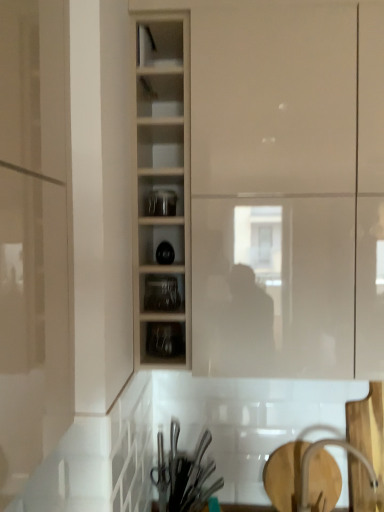
Question: Does clear glass jars at center, the first shelf in the top-to-bottom sequence, have a smaller size compared to matte white cupboard at center?

Choices:
 (A) yes
 (B) no

Answer: (A)

Question: Is the depth of clear glass jars at center, the first shelf in the top-to-bottom sequence, greater than that of matte white cupboard at center?

Choices:
 (A) no
 (B) yes

Answer: (B)

Question: Can you confirm if clear glass jars at center, the first shelf in the top-to-bottom sequence, is taller than matte white cupboard at center?

Choices:
 (A) yes
 (B) no

Answer: (B)

Question: Is clear glass jars at center, which ranks as the second shelf in bottom-to-top order, oriented away from matte white cupboard at center?

Choices:
 (A) no
 (B) yes

Answer: (A)

Question: Does clear glass jars at center, the first shelf in the top-to-bottom sequence, touch matte white cupboard at center?

Choices:
 (A) no
 (B) yes

Answer: (A)

Question: Based on their positions, is white glossy faucet at lower right located to the left or right of clear glass jars at center, the first shelf in the top-to-bottom sequence?

Choices:
 (A) right
 (B) left

Answer: (A)

Question: Is white glossy faucet at lower right spatially inside clear glass jars at center, which ranks as the second shelf in bottom-to-top order, or outside of it?

Choices:
 (A) outside
 (B) inside

Answer: (A)

Question: Is white glossy faucet at lower right taller or shorter than clear glass jars at center, the first shelf in the top-to-bottom sequence?

Choices:
 (A) short
 (B) tall

Answer: (B)

Question: From the image's perspective, relative to clear glass jars at center, the first shelf in the top-to-bottom sequence, is white glossy faucet at lower right above or below?

Choices:
 (A) above
 (B) below

Answer: (B)

Question: Relative to wooden shelves at center, is transparent glass jars at center, the 2th tableware from the back, in front or behind?

Choices:
 (A) front
 (B) behind

Answer: (B)

Question: Does point (167, 209) appear closer or farther from the camera than point (135, 109)?

Choices:
 (A) farther
 (B) closer

Answer: (A)

Question: Choose the correct answer: Is transparent glass jars at center, the 2th tableware from the bottom, inside wooden shelves at center or outside it?

Choices:
 (A) outside
 (B) inside

Answer: (B)

Question: From a real-world perspective, is transparent glass jars at center, the 2th tableware from the bottom, positioned above or below wooden shelves at center?

Choices:
 (A) above
 (B) below

Answer: (B)

Question: Is clear glass jars at center, the 2th shelf viewed from the top, in front of or behind metallic silver utensils at lower center, which is counted as the 2th tableware, starting from the front, in the image?

Choices:
 (A) behind
 (B) front

Answer: (B)

Question: From their relative heights in the image, would you say clear glass jars at center, which is the 1th shelf from bottom to top, is taller or shorter than metallic silver utensils at lower center, acting as the second tableware starting from the top?

Choices:
 (A) short
 (B) tall

Answer: (A)